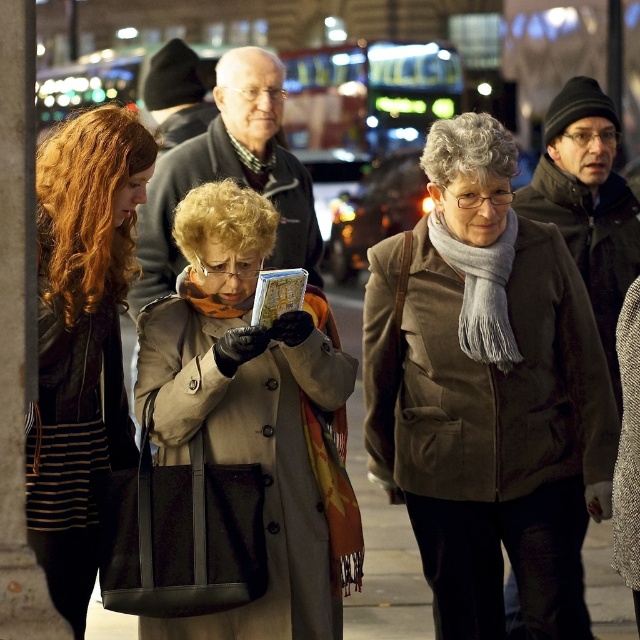
You are a photographer aiming to capture a clear shot of both the beige woolen coat at center and the matte black jacket at left. Since you want to ensure both are in focus, which one should you focus on first to account for their positions?

You should focus on the beige woolen coat at center first because it is closer to you than the matte black jacket at left, so adjusting focus from near to far will help both be in focus.

Consider the image. You are a photographer trying to capture the person in the beige coat and scarf holding a map in the urban night scene. The camera you are using has a limited field of view. Can you determine if the beige woolen coat at center is within the camera frame marked by the point at coordinates (x=260, y=454)?

The point at coordinates (x=260, y=454) marks the beige woolen coat at center, so yes, the beige woolen coat at center is within the camera frame marked by that point.

You are a photographer trying to capture a candid shot of the two people in the center of the image. The brown suede coat at center and the gray woolen wig at center are close to each other. Which one is positioned lower in the frame?

The brown suede coat at center is below the gray woolen wig at center, so it is positioned lower in the frame.